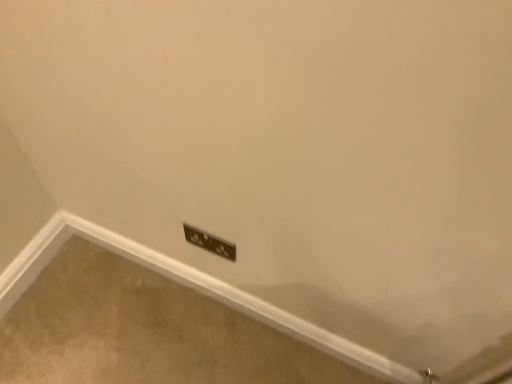
Question: Is black plastic power plugs and sockets at lower center with metallic socket at lower center?

Choices:
 (A) no
 (B) yes

Answer: (A)

Question: Are black plastic power plugs and sockets at lower center and metallic socket at lower center located far from each other?

Choices:
 (A) yes
 (B) no

Answer: (B)

Question: Does black plastic power plugs and sockets at lower center appear on the right side of metallic socket at lower center?

Choices:
 (A) no
 (B) yes

Answer: (A)

Question: Does black plastic power plugs and sockets at lower center have a lesser width compared to metallic socket at lower center?

Choices:
 (A) yes
 (B) no

Answer: (A)

Question: From a real-world perspective, is black plastic power plugs and sockets at lower center positioned over metallic socket at lower center based on gravity?

Choices:
 (A) no
 (B) yes

Answer: (B)

Question: Can you confirm if black plastic power plugs and sockets at lower center is shorter than metallic socket at lower center?

Choices:
 (A) yes
 (B) no

Answer: (A)

Question: Is metallic socket at lower center positioned behind black plastic power plugs and sockets at lower center?

Choices:
 (A) yes
 (B) no

Answer: (A)

Question: Is metallic socket at lower center positioned before black plastic power plugs and sockets at lower center?

Choices:
 (A) no
 (B) yes

Answer: (A)

Question: Are metallic socket at lower center and black plastic power plugs and sockets at lower center making contact?

Choices:
 (A) no
 (B) yes

Answer: (A)

Question: Is metallic socket at lower center shorter than black plastic power plugs and sockets at lower center?

Choices:
 (A) no
 (B) yes

Answer: (A)

Question: Is metallic socket at lower center facing away from black plastic power plugs and sockets at lower center?

Choices:
 (A) no
 (B) yes

Answer: (A)

Question: Does metallic socket at lower center have a greater width compared to black plastic power plugs and sockets at lower center?

Choices:
 (A) no
 (B) yes

Answer: (B)

Question: In the image, is black plastic power plugs and sockets at lower center on the left side or the right side of metallic socket at lower center?

Choices:
 (A) right
 (B) left

Answer: (B)